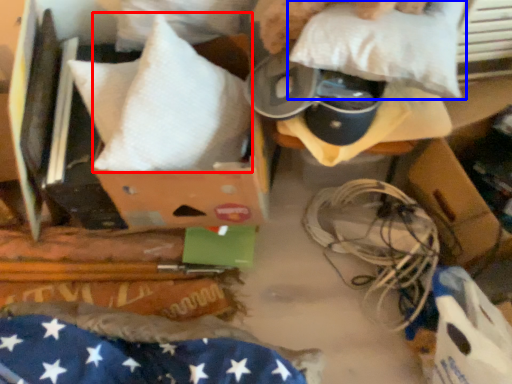
Question: Which object appears closest to the camera in this image, pillow (highlighted by a red box) or pillow (highlighted by a blue box)?

Choices:
 (A) pillow
 (B) pillow

Answer: (B)